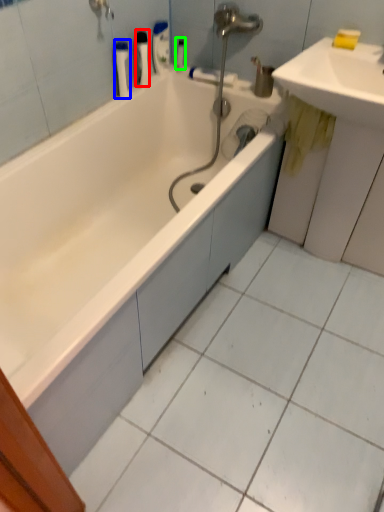
Question: Estimate the real-world distances between objects in this image. Which object is closer to toiletry (highlighted by a red box), toiletry (highlighted by a blue box) or toiletry (highlighted by a green box)?

Choices:
 (A) toiletry
 (B) toiletry

Answer: (A)